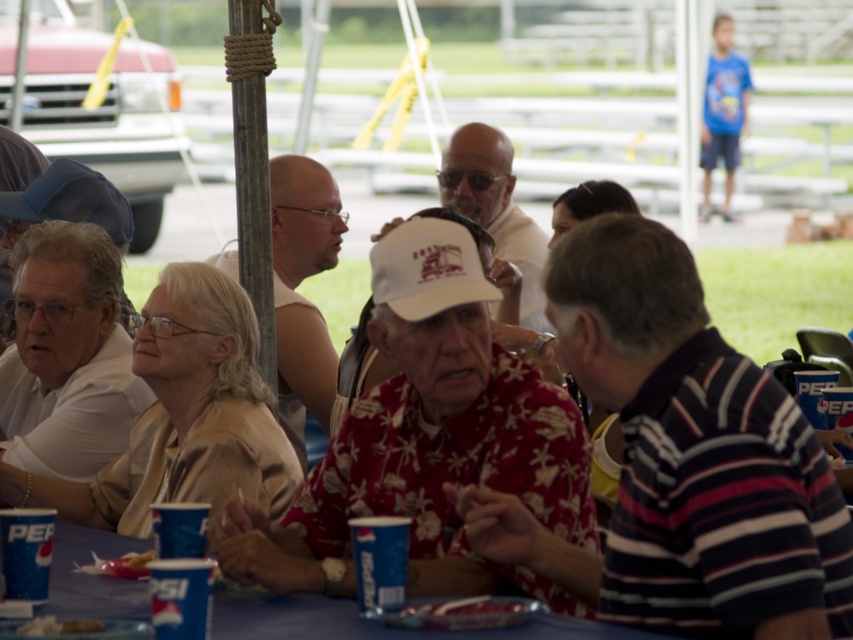
Looking at this image, you are a guest at this outdoor event and want to grab a drink from the table. Which object should you reach for first to get your drink, the blue paper cups at lower center or the white paper plate at lower center?

The blue paper cups at lower center are closer to you than the white paper plate at lower center, so you should reach for the blue paper cups at lower center first to get your drink.

You are standing at the edge of the gathering and want to take a photo of the two points mentioned. Which point, point (306, 632) or point (51, 634), is closer to your camera lens?

Point (306, 632) is closer to the camera lens because it is further to the viewer than point (51, 634).

You are at the gathering and want to grab a drink. The blue paper cups at lower center are located at point 0.972, 0.438. Where exactly are they placed in the image?

The blue paper cups at lower center are placed at point (373, 621) in the image.